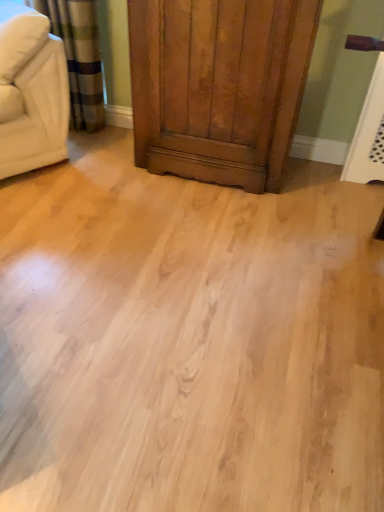
Identify the location of free location to the right of shiny brown wood dresser at center. The image size is (384, 512). (328, 194).